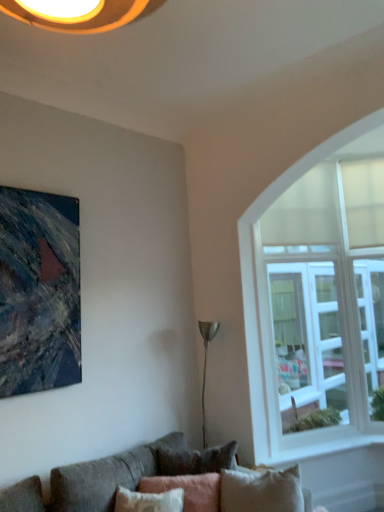
Question: Do you think textured canvas painting at upper left is within white glass window at right, or outside of it?

Choices:
 (A) inside
 (B) outside

Answer: (B)

Question: From a real-world perspective, is textured canvas painting at upper left physically located above or below white glass window at right?

Choices:
 (A) above
 (B) below

Answer: (A)

Question: Which object is positioned farthest from the pink fabric pillow at lower center?

Choices:
 (A) textured canvas painting at upper left
 (B) textured gray couch at lower left
 (C) white glass window at right

Answer: (A)

Question: Which object is the closest to the white glass window at right?

Choices:
 (A) pink fabric pillow at lower center
 (B) textured gray couch at lower left
 (C) textured canvas painting at upper left

Answer: (A)